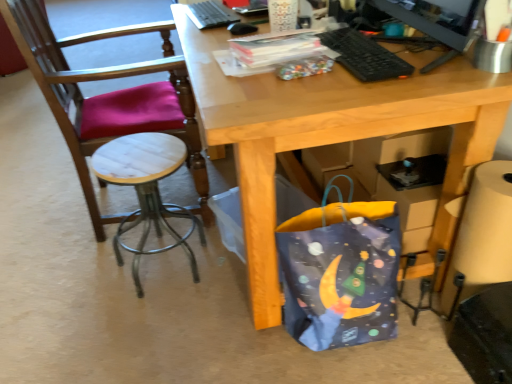
Measure the distance between black plastic keyboard at upper center, the first laptop keyboard positioned from the back, and camera.

They are 4.55 feet apart.

What is the approximate width of black glossy monitor at upper right?

The width of black glossy monitor at upper right is 14.29 centimeters.

Locate an element on the screen. The image size is (512, 384). black glossy monitor at upper right is located at coordinates (437, 21).

The width and height of the screenshot is (512, 384). Describe the element at coordinates (146, 191) in the screenshot. I see `white marble stool at left` at that location.

In order to face blue fabric bag at lower right, should I rotate leftwards or rightwards?

To align with it, rotate right about 11.604°.

Find the location of a particular element. The image size is (512, 384). black plastic keyboard at upper center, the second laptop keyboard positioned from the top is located at coordinates (364, 56).

In order to click on black matte mouse at upper center in this screenshot , I will do `click(241, 28)`.

Where is `black plastic keyboard at upper center, which ranks as the 2th laptop keyboard in bottom-to-top order`? Image resolution: width=512 pixels, height=384 pixels. black plastic keyboard at upper center, which ranks as the 2th laptop keyboard in bottom-to-top order is located at coordinates (211, 14).

Where is `stool lying below the black glossy monitor at upper right (from the image's perspective)`? The image size is (512, 384). stool lying below the black glossy monitor at upper right (from the image's perspective) is located at coordinates click(x=146, y=191).

Would you say white marble stool at left is to the left or to the right of black glossy monitor at upper right in the picture?

white marble stool at left is to the left of black glossy monitor at upper right.

Is white marble stool at left oriented towards black glossy monitor at upper right?

No, white marble stool at left is not aimed at black glossy monitor at upper right.

How distant is white marble stool at left from black glossy monitor at upper right?

They are 3.66 feet apart.

Is white marble stool at left at the right side of black plastic keyboard at upper center, which ranks as the 2th laptop keyboard in bottom-to-top order?

No.

Is white marble stool at left spatially inside black plastic keyboard at upper center, which is counted as the first laptop keyboard, starting from the left, or outside of it?

white marble stool at left is not enclosed by black plastic keyboard at upper center, which is counted as the first laptop keyboard, starting from the left.

From a real-world perspective, is white marble stool at left below black plastic keyboard at upper center, which ranks as the 2th laptop keyboard in bottom-to-top order?

Yes, from a real-world perspective, white marble stool at left is below black plastic keyboard at upper center, which ranks as the 2th laptop keyboard in bottom-to-top order.

Would you say black plastic keyboard at upper center, which is the second laptop keyboard from back to front, is outside black glossy monitor at upper right?

Indeed, black plastic keyboard at upper center, which is the second laptop keyboard from back to front, is completely outside black glossy monitor at upper right.

Where is `computer monitor lying on the right of black plastic keyboard at upper center, the 1th laptop keyboard from the right`? The height and width of the screenshot is (384, 512). computer monitor lying on the right of black plastic keyboard at upper center, the 1th laptop keyboard from the right is located at coordinates coord(437,21).

Which of these two, black plastic keyboard at upper center, which is the 2th laptop keyboard from left to right, or black glossy monitor at upper right, is smaller?

black plastic keyboard at upper center, which is the 2th laptop keyboard from left to right, is smaller.

Is black glossy monitor at upper right aimed at black plastic keyboard at upper center, which is the second laptop keyboard from back to front?

Yes.

Considering their positions, is black glossy monitor at upper right located in front of or behind black plastic keyboard at upper center, arranged as the first laptop keyboard when ordered from the bottom?

Clearly, black glossy monitor at upper right is in front of black plastic keyboard at upper center, arranged as the first laptop keyboard when ordered from the bottom.

Can you confirm if black glossy monitor at upper right is taller than black plastic keyboard at upper center, the 1th laptop keyboard from the right?

Yes.

Is black plastic keyboard at upper center, which is counted as the first laptop keyboard, starting from the left, not within wooden/marble stool at left?

That's correct, black plastic keyboard at upper center, which is counted as the first laptop keyboard, starting from the left, is outside of wooden/marble stool at left.

Is black plastic keyboard at upper center, placed as the first laptop keyboard when sorted from top to bottom, taller or shorter than wooden/marble stool at left?

Considering their sizes, black plastic keyboard at upper center, placed as the first laptop keyboard when sorted from top to bottom, has less height than wooden/marble stool at left.

Considering the relative positions of black plastic keyboard at upper center, the first laptop keyboard positioned from the back, and wooden/marble stool at left in the image provided, is black plastic keyboard at upper center, the first laptop keyboard positioned from the back, to the left of wooden/marble stool at left from the viewer's perspective?

Incorrect, black plastic keyboard at upper center, the first laptop keyboard positioned from the back, is not on the left side of wooden/marble stool at left.

From a real-world perspective, is black plastic keyboard at upper center, the first laptop keyboard positioned from the back, located higher than wooden/marble stool at left?

Yes.

Is black plastic keyboard at upper center, the second laptop keyboard positioned from the top, at the back of white marble stool at left?

No, white marble stool at left's orientation is not away from black plastic keyboard at upper center, the second laptop keyboard positioned from the top.

Looking at this image, between white marble stool at left and black plastic keyboard at upper center, the second laptop keyboard positioned from the top, which one appears on the left side from the viewer's perspective?

Positioned to the left is white marble stool at left.

Considering the relative sizes of white marble stool at left and black plastic keyboard at upper center, which is counted as the 1th laptop keyboard, starting from the front, in the image provided, is white marble stool at left shorter than black plastic keyboard at upper center, which is counted as the 1th laptop keyboard, starting from the front,?

In fact, white marble stool at left may be taller than black plastic keyboard at upper center, which is counted as the 1th laptop keyboard, starting from the front.

Which object is further away from the camera, white marble stool at left or black plastic keyboard at upper center, the second laptop keyboard positioned from the top?

white marble stool at left is more distant.

How different are the orientations of wooden/marble stool at left and black plastic keyboard at upper center, arranged as the first laptop keyboard when ordered from the bottom, in degrees?

178 degrees separate the facing orientations of wooden/marble stool at left and black plastic keyboard at upper center, arranged as the first laptop keyboard when ordered from the bottom.

Based on the photo, is wooden/marble stool at left wider than black plastic keyboard at upper center, arranged as the first laptop keyboard when ordered from the bottom?

Correct, the width of wooden/marble stool at left exceeds that of black plastic keyboard at upper center, arranged as the first laptop keyboard when ordered from the bottom.

Is wooden/marble stool at left in front of or behind black plastic keyboard at upper center, which is counted as the 1th laptop keyboard, starting from the front, in the image?

wooden/marble stool at left is positioned farther from the viewer than black plastic keyboard at upper center, which is counted as the 1th laptop keyboard, starting from the front.

In the image, is wooden/marble stool at left on the left side or the right side of black plastic keyboard at upper center, which is the 2th laptop keyboard from left to right?

Clearly, wooden/marble stool at left is on the left of black plastic keyboard at upper center, which is the 2th laptop keyboard from left to right, in the image.

Locate an element on the screen. Image resolution: width=512 pixels, height=384 pixels. computer monitor on the right of white marble stool at left is located at coordinates (437, 21).

The height and width of the screenshot is (384, 512). In order to click on laptop keyboard behind the white marble stool at left in this screenshot , I will do `click(211, 14)`.

From the image, which object appears to be nearer to wooden/marble stool at left, white marble stool at left or blue fabric bag at lower right?

white marble stool at left is closer to wooden/marble stool at left.

Looking at the image, which one is located closer to wooden/marble stool at left, white marble stool at left or black plastic keyboard at upper center, the 1th laptop keyboard from the right?

white marble stool at left.

From the picture: From the image, which object appears to be nearer to white marble stool at left, black plastic keyboard at upper center, the 1th laptop keyboard from the right, or wooden/marble stool at left?

The object closer to white marble stool at left is wooden/marble stool at left.

Which object lies nearer to the anchor point black matte mouse at upper center, wooden/marble stool at left or white marble stool at left?

wooden/marble stool at left is closer to black matte mouse at upper center.

Based on their spatial positions, is wooden/marble stool at left or white marble stool at left closer to black plastic keyboard at upper center, which ranks as the 2th laptop keyboard in bottom-to-top order?

wooden/marble stool at left is closer to black plastic keyboard at upper center, which ranks as the 2th laptop keyboard in bottom-to-top order.

When comparing their distances from black plastic keyboard at upper center, which is counted as the first laptop keyboard, starting from the left, does black plastic keyboard at upper center, the 1th laptop keyboard from the right, or wooden/marble stool at left seem closer?

wooden/marble stool at left.

Estimate the real-world distances between objects in this image. Which object is closer to white marble stool at left, wooden/marble stool at left or black plastic keyboard at upper center, the first laptop keyboard positioned from the back?

The object closer to white marble stool at left is wooden/marble stool at left.

Which object lies further to the anchor point black glossy monitor at upper right, white marble stool at left or wooden/marble stool at left?

white marble stool at left.

Identify the location of mouse that lies between black plastic keyboard at upper center, placed as the first laptop keyboard when sorted from top to bottom, and blue fabric bag at lower right from top to bottom. (241, 28).

Locate an element on the screen. laptop keyboard between wooden/marble stool at left and black plastic keyboard at upper center, the second laptop keyboard positioned from the top, in the horizontal direction is located at coordinates [x=211, y=14].

Where is `computer monitor between black matte mouse at upper center and blue fabric bag at lower right in the up-down direction`? Image resolution: width=512 pixels, height=384 pixels. computer monitor between black matte mouse at upper center and blue fabric bag at lower right in the up-down direction is located at coordinates (437, 21).

Identify the location of laptop keyboard between wooden/marble stool at left and black matte mouse at upper center from left to right. Image resolution: width=512 pixels, height=384 pixels. (211, 14).